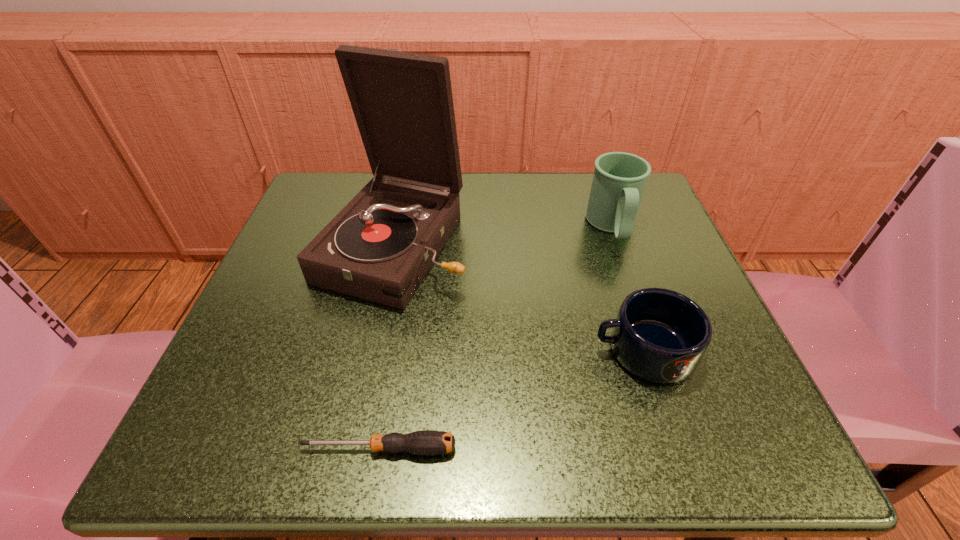
Identify the location of the tallest object. (379, 247).

Locate an element on the screen. The image size is (960, 540). the third shortest object is located at coordinates (619, 179).

At what (x,y) coordinates should I click in order to perform the action: click on the farther mug. Please return your answer as a coordinate pair (x, y). This screenshot has width=960, height=540. Looking at the image, I should click on (619, 179).

Find the location of `the second nearest object`. the second nearest object is located at coordinates (659, 335).

Where is `the shorter mug`? The height and width of the screenshot is (540, 960). the shorter mug is located at coordinates (659, 335).

I want to click on the shortest object, so click(x=425, y=442).

Locate an element on the screen. This screenshot has width=960, height=540. screwdriver is located at coordinates (425, 442).

Locate an element on the screen. The image size is (960, 540). free space located on the right of the tallest object is located at coordinates (505, 246).

Identify the location of free space located on the side of the third shortest object with the handle. Image resolution: width=960 pixels, height=540 pixels. (627, 269).

Locate an element on the screen. vacant region located with the handle on the side of the shorter mug is located at coordinates (533, 350).